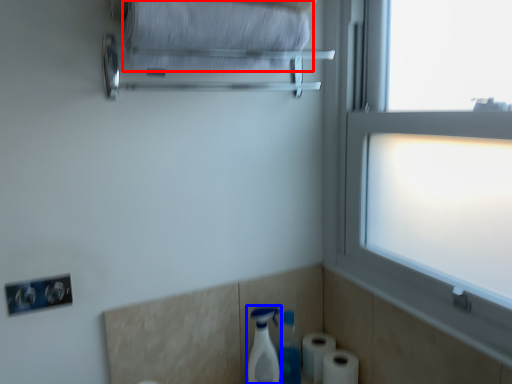
Question: Which object is further to the camera taking this photo, bath towel (highlighted by a red box) or cleaning product (highlighted by a blue box)?

Choices:
 (A) bath towel
 (B) cleaning product

Answer: (B)